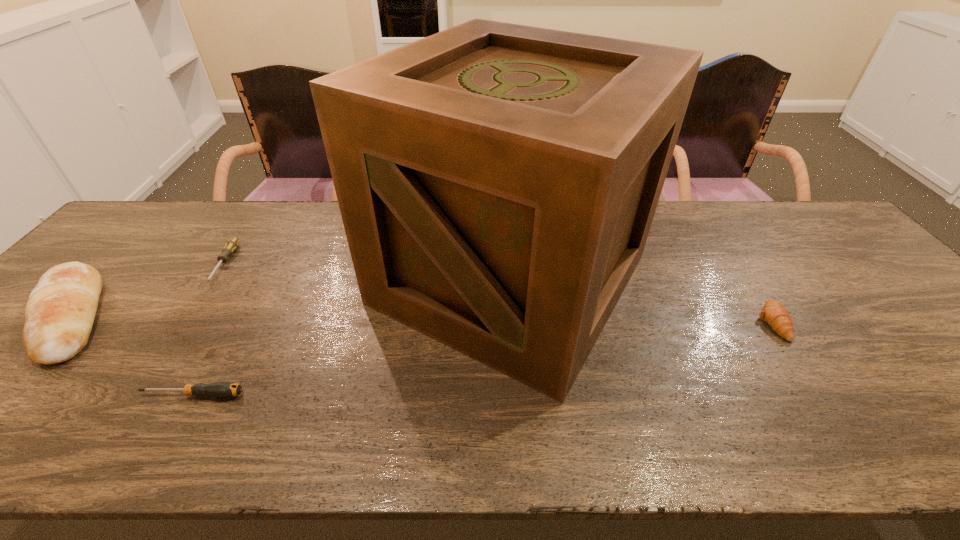
The width and height of the screenshot is (960, 540). Find the location of `screwdriver situated at the far edge`. screwdriver situated at the far edge is located at coordinates (231, 245).

Where is `vacant area at the far edge of the desktop`? This screenshot has height=540, width=960. vacant area at the far edge of the desktop is located at coordinates (253, 214).

In the image, there is a desktop. Where is `free space at the near edge`? This screenshot has height=540, width=960. free space at the near edge is located at coordinates (490, 425).

Image resolution: width=960 pixels, height=540 pixels. In the image, there is a desktop. Identify the location of vacant space at the left edge. (53, 371).

Where is `free location at the right edge of the desktop`? The width and height of the screenshot is (960, 540). free location at the right edge of the desktop is located at coordinates (803, 250).

Where is `free region at the far left corner of the desktop`? The height and width of the screenshot is (540, 960). free region at the far left corner of the desktop is located at coordinates (156, 211).

Identify the location of blank space at the far right corner. (775, 211).

You are a GUI agent. You are given a task and a screenshot of the screen. Output one action in this format:
    pyautogui.click(x=<x>, y=<y>)
    Task: Click on the unoccupied area between the nearer screwdriver and the tallest object
    This screenshot has height=540, width=960.
    Given the screenshot: What is the action you would take?
    pyautogui.click(x=351, y=338)

Identify the location of unoccupied area between the nearer screwdriver and the farther screwdriver. (208, 329).

Identify the location of free space between the tallest object and the crescent roll. (641, 301).